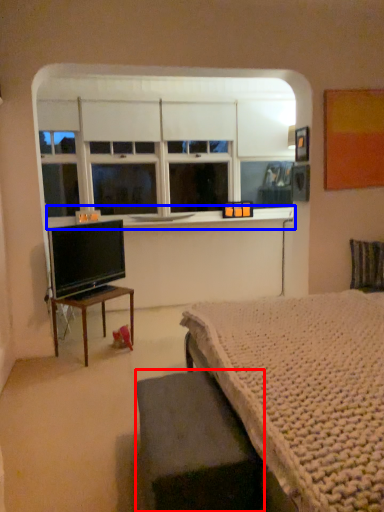
Question: Among these objects, which one is farthest to the camera, table (highlighted by a red box) or window sill (highlighted by a blue box)?

Choices:
 (A) table
 (B) window sill

Answer: (B)